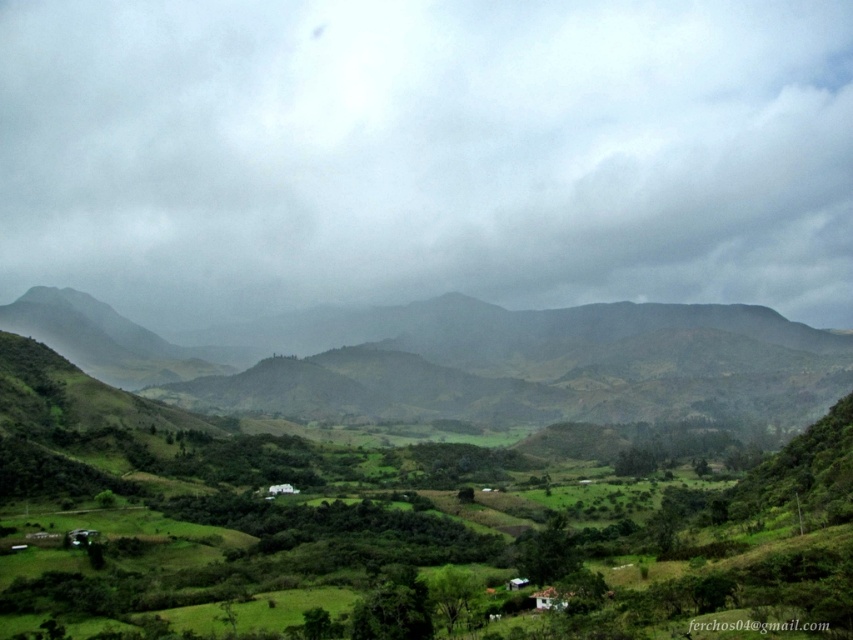
Question: Which point is farther to the camera?

Choices:
 (A) (228, 362)
 (B) (834, 273)

Answer: (B)

Question: Does cloudy sky at upper center have a lesser width compared to green grassy hill at center?

Choices:
 (A) yes
 (B) no

Answer: (B)

Question: Considering the relative positions of cloudy sky at upper center and green grassy hill at center in the image provided, where is cloudy sky at upper center located with respect to green grassy hill at center?

Choices:
 (A) above
 (B) below

Answer: (A)

Question: Which of the following is the farthest from the observer?

Choices:
 (A) (56, 326)
 (B) (483, 244)

Answer: (B)

Question: Is cloudy sky at upper center smaller than green grassy hill at center?

Choices:
 (A) yes
 (B) no

Answer: (B)